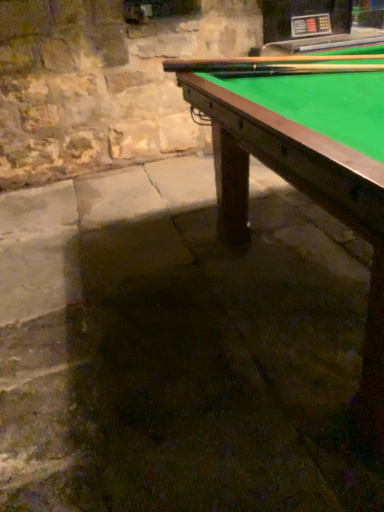
Question: Is smooth wood cue at upper right, which is the first cue from bottom to top, not inside wooden cue at upper right, positioned as the second cue in bottom-to-top order?

Choices:
 (A) yes
 (B) no

Answer: (A)

Question: From a real-world perspective, is smooth wood cue at upper right, which is the first cue from bottom to top, below wooden cue at upper right, positioned as the second cue in bottom-to-top order?

Choices:
 (A) no
 (B) yes

Answer: (B)

Question: Is the position of smooth wood cue at upper right, the 2th cue in the top-to-bottom sequence, more distant than that of wooden cue at upper right, positioned as the second cue in bottom-to-top order?

Choices:
 (A) no
 (B) yes

Answer: (B)

Question: Does smooth wood cue at upper right, the 2th cue in the top-to-bottom sequence, come in front of wooden cue at upper right, marked as the 1th cue in a top-to-bottom arrangement?

Choices:
 (A) yes
 (B) no

Answer: (B)

Question: Is smooth wood cue at upper right, the 2th cue in the top-to-bottom sequence, taller than wooden cue at upper right, positioned as the second cue in bottom-to-top order?

Choices:
 (A) yes
 (B) no

Answer: (A)

Question: From the image's perspective, is smooth wood cue at upper right, which is the first cue from bottom to top, below wooden cue at upper right, positioned as the second cue in bottom-to-top order?

Choices:
 (A) yes
 (B) no

Answer: (A)

Question: Can you confirm if smooth wood cue at upper right, the 2th cue in the top-to-bottom sequence, is smaller than green felt billiard table at upper right?

Choices:
 (A) yes
 (B) no

Answer: (A)

Question: Considering the relative positions of smooth wood cue at upper right, which is the first cue from bottom to top, and green felt billiard table at upper right in the image provided, is smooth wood cue at upper right, which is the first cue from bottom to top, to the left of green felt billiard table at upper right from the viewer's perspective?

Choices:
 (A) yes
 (B) no

Answer: (A)

Question: Is smooth wood cue at upper right, which is the first cue from bottom to top, in front of green felt billiard table at upper right?

Choices:
 (A) no
 (B) yes

Answer: (A)

Question: Is smooth wood cue at upper right, which is the first cue from bottom to top, shorter than green felt billiard table at upper right?

Choices:
 (A) no
 (B) yes

Answer: (B)

Question: From the image's perspective, does smooth wood cue at upper right, the 2th cue in the top-to-bottom sequence, appear higher than green felt billiard table at upper right?

Choices:
 (A) yes
 (B) no

Answer: (A)

Question: Can you confirm if wooden cue at upper right, marked as the 1th cue in a top-to-bottom arrangement, is shorter than smooth wood cue at upper right, which is the first cue from bottom to top?

Choices:
 (A) yes
 (B) no

Answer: (A)